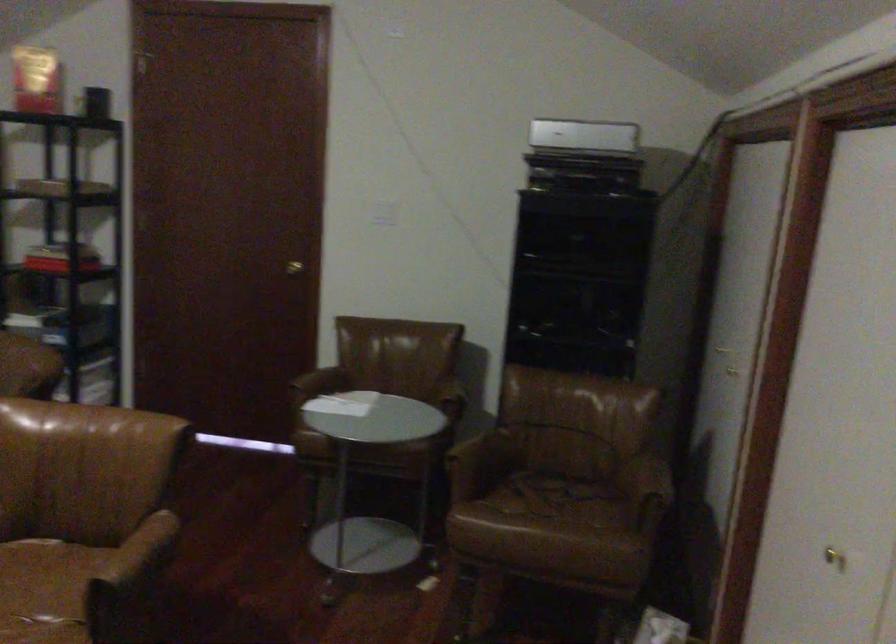
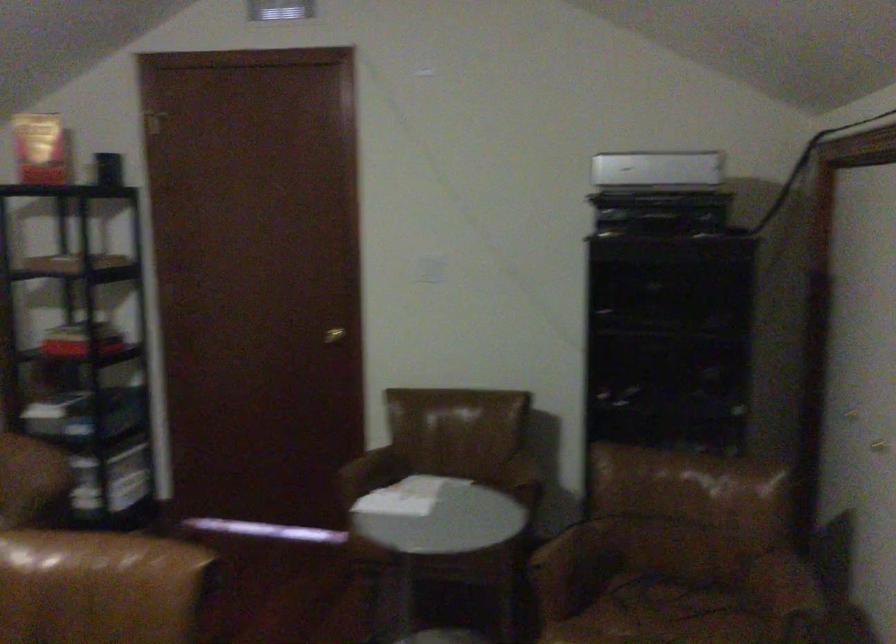
Question: What movement of the cameraman would produce the second image?

Choices:
 (A) Left
 (B) Right
 (C) Forward
 (D) Backward

Answer: (C)